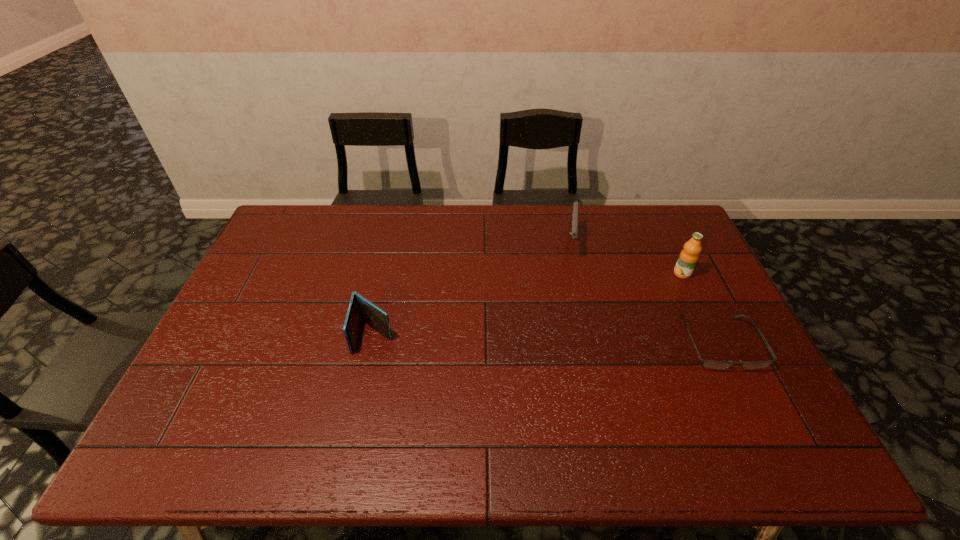
Identify the location of free space between the shortest object and the leftmost object. This screenshot has height=540, width=960. (547, 339).

You are a GUI agent. You are given a task and a screenshot of the screen. Output one action in this format:
    pyautogui.click(x=<x>, y=<y>)
    Task: Click on the empty space that is in between the orange juice and the farthest object
    Image resolution: width=960 pixels, height=540 pixels.
    Given the screenshot: What is the action you would take?
    pyautogui.click(x=626, y=258)

Where is `free space that is in between the spectacles and the pistol`? This screenshot has height=540, width=960. free space that is in between the spectacles and the pistol is located at coordinates (645, 293).

Identify which object is the second closest to the wallet. Please provide its 2D coordinates. Your answer should be formatted as a tuple, i.e. [(x, y)], where the tuple contains the x and y coordinates of a point satisfying the conditions above.

[(709, 364)]

Where is `object that stands as the third closest to the spectacles`? The image size is (960, 540). object that stands as the third closest to the spectacles is located at coordinates (359, 309).